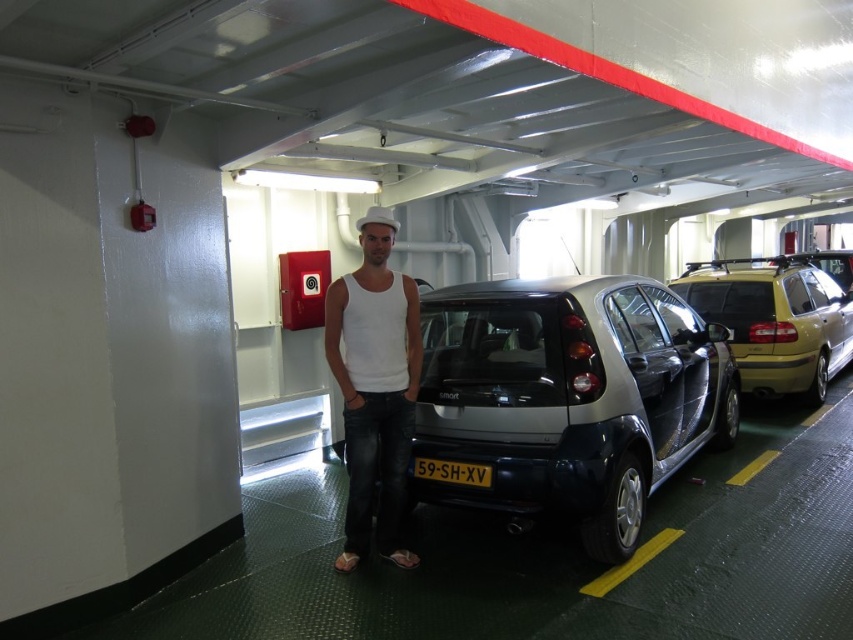
Question: Is metallic silver car at center smaller than black plastic license plate at center?

Choices:
 (A) no
 (B) yes

Answer: (A)

Question: Is the position of white matte tank top at center more distant than that of black plastic license plate at center?

Choices:
 (A) yes
 (B) no

Answer: (A)

Question: Which point is closer to the camera taking this photo?

Choices:
 (A) (770, 349)
 (B) (347, 464)

Answer: (B)

Question: Among these points, which one is farthest from the camera?

Choices:
 (A) (585, 525)
 (B) (431, 460)
 (C) (403, 451)

Answer: (B)

Question: Is metallic silver car at center behind white matte tank top at center?

Choices:
 (A) yes
 (B) no

Answer: (B)

Question: Which object is positioned farthest from the metallic silver car at center?

Choices:
 (A) black plastic license plate at center
 (B) white matte tank top at center
 (C) metallic gold suv at right

Answer: (C)